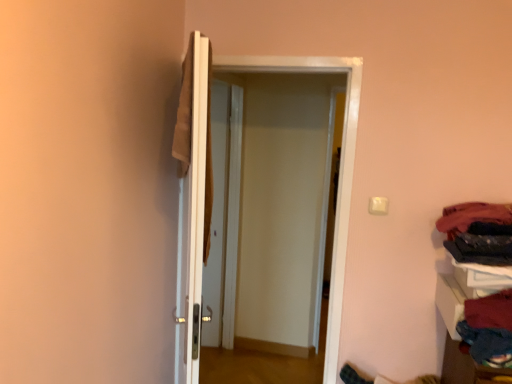
Identify the location of vacant space situated above velvet red sweater at lower right, which is the 3th clothing in top-to-bottom order (from a real-world perspective). (486, 312).